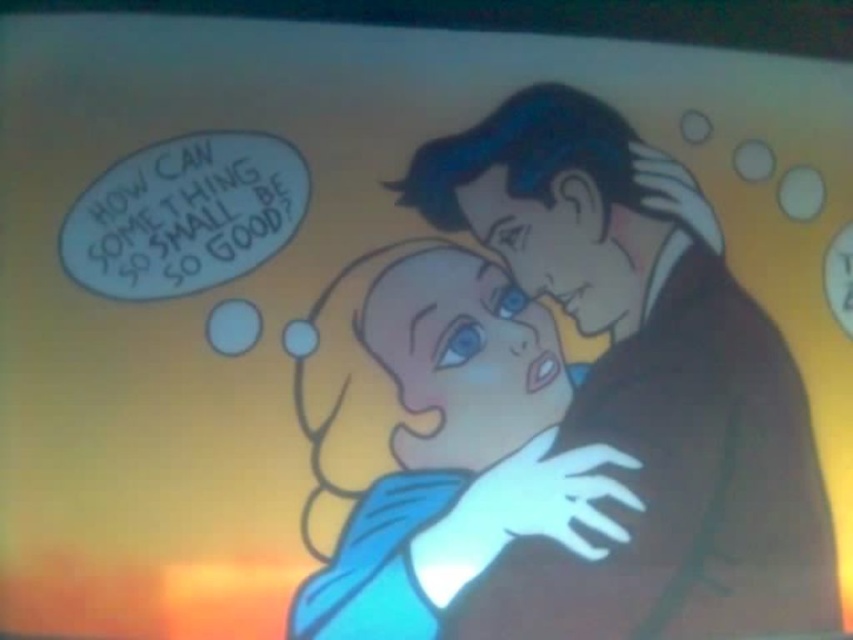
You are an observer looking at the image. There are two characters in the scene, the smooth brown suit at center and the blue fabric baby at center. Which one is located to the right side of the other?

The smooth brown suit at center is positioned on the right side of blue fabric baby at center.

In the scene shown: You are an architect designing a virtual reality environment based on the scene. You need to place a virtual marker exactly at the coordinates where the smooth brown suit at center is located. What are the coordinates you should use?

The coordinates for the smooth brown suit at center are point (x=641, y=385).

You are standing in front of a painting that shows two characters in an embrace under a sunset. The painting has a point marked at coordinates point (596, 230). If you want to touch this point with your hand, which is 2 feet long, can you reach it without moving your position?

The distance between point (596, 230) and the viewer is 6.38 feet, which is greater than the 2 feet length of your hand. Therefore, you cannot reach the point without moving closer.